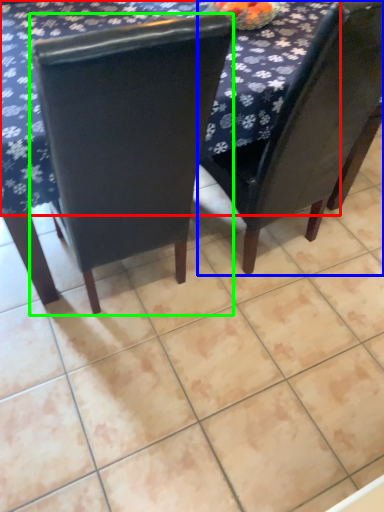
Question: Which object is the closest to the tablecloth (highlighted by a red box)? Choose among these: chair (highlighted by a blue box) or chair (highlighted by a green box).

Choices:
 (A) chair
 (B) chair

Answer: (B)